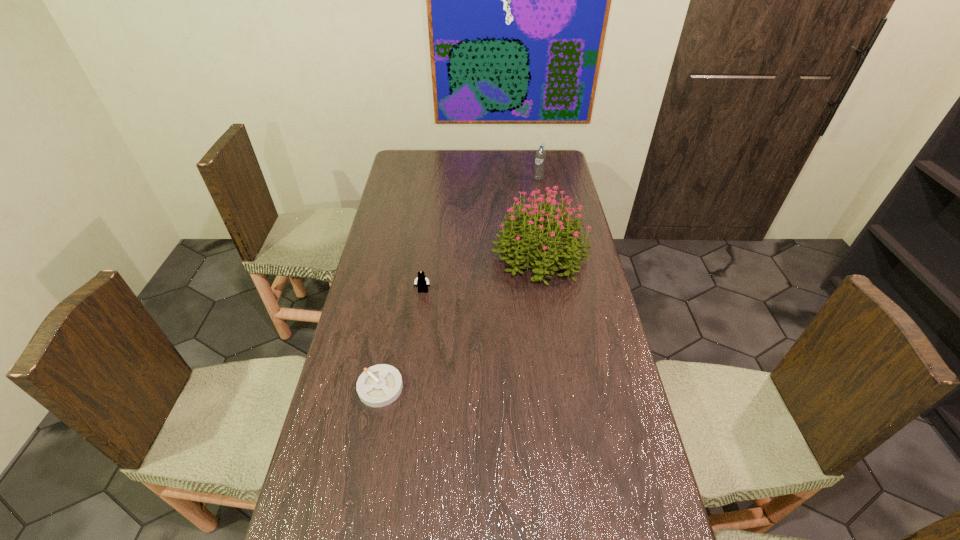
Where is `the tallest object`? the tallest object is located at coordinates click(x=542, y=228).

Find the location of a particular element. The height and width of the screenshot is (540, 960). the farthest object is located at coordinates (540, 156).

Identify the location of the third shortest object. (540, 156).

The height and width of the screenshot is (540, 960). Identify the location of Lego. (422, 281).

Locate an element on the screen. the shortest object is located at coordinates (379, 385).

Where is `the nearest object`? the nearest object is located at coordinates (379, 385).

Identify the location of vacant space situated 0.140m on the back of the bouquet. The width and height of the screenshot is (960, 540). [532, 205].

This screenshot has width=960, height=540. What are the coordinates of `free space located 0.300m on the front of the farthest object` in the screenshot? It's located at (545, 221).

The height and width of the screenshot is (540, 960). I want to click on vacant position located 0.080m on the front-facing side of the third tallest object, so click(420, 313).

Where is `free space located on the left of the shortest object`? free space located on the left of the shortest object is located at coordinates (337, 387).